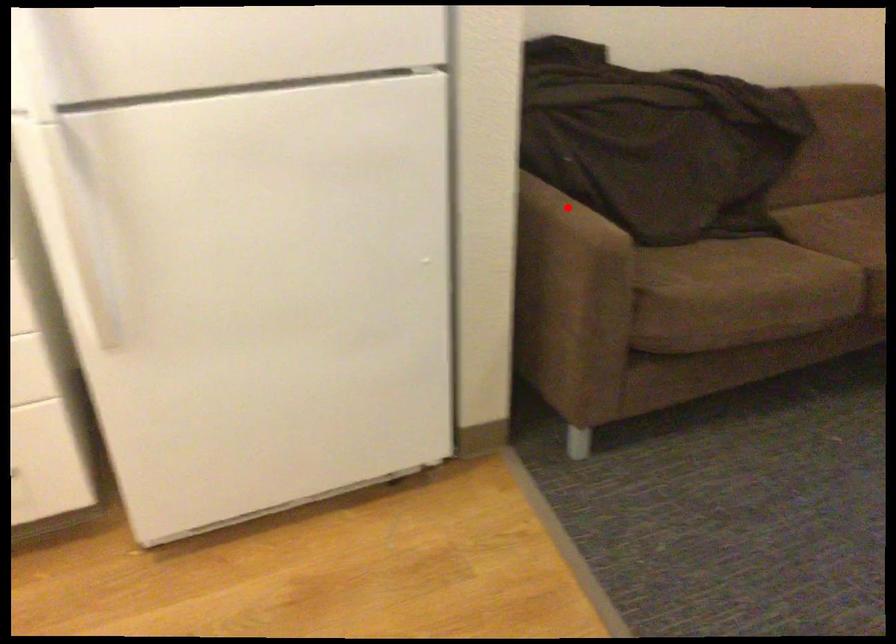
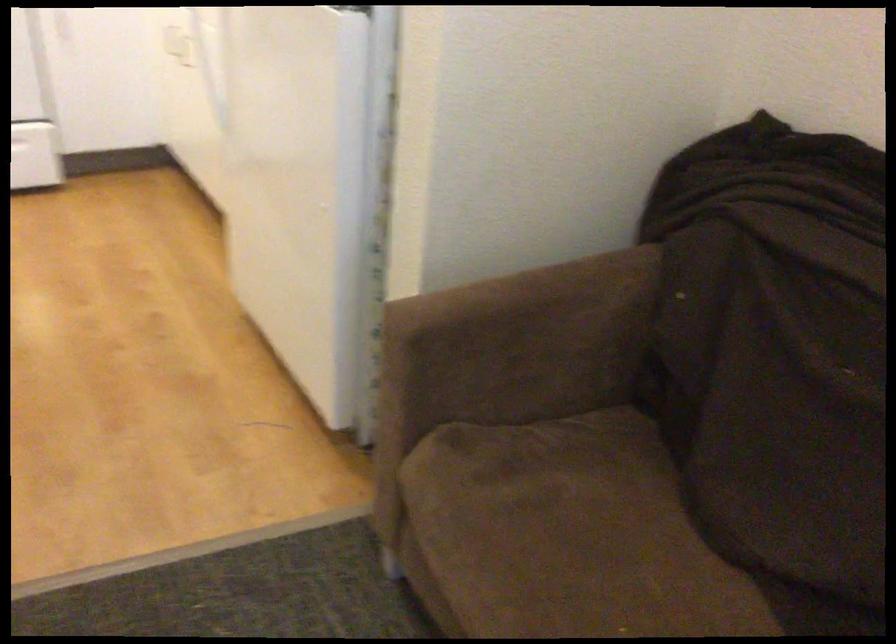
Question: I am providing you with two images of the same scene from different viewpoints. Image1 has a red point marked. In image2, the corresponding 3D location appears at what relative position? Reply with the corresponding letter.

Choices:
 (A) Closer
 (B) Farther

Answer: (A)